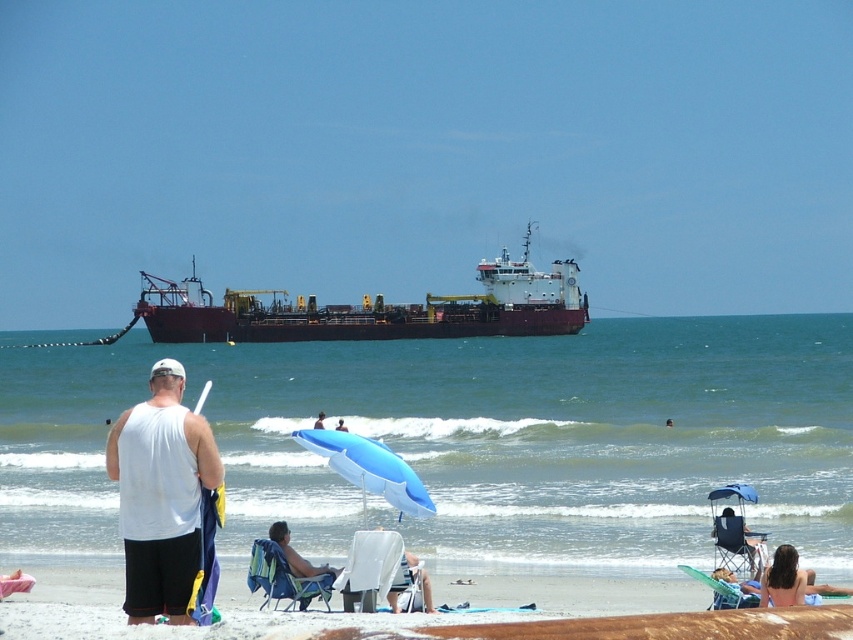
You are a beachgoer wanting to sit in a shaded area. The blue fabric beach chair at lower right and the smooth blue umbrella at center are both available. Which option provides more shade coverage?

The smooth blue umbrella at center provides more shade coverage because it is larger than the blue fabric beach chair at lower right.

You are standing on the beach and want to reach the dark blue water at center as quickly as possible. Which direction should you head towards?

The dark blue water at center is located at coordinates 0.686 on the x axis and 0.553 on the y axis, so you should head towards the direction of those coordinates to reach it quickly.